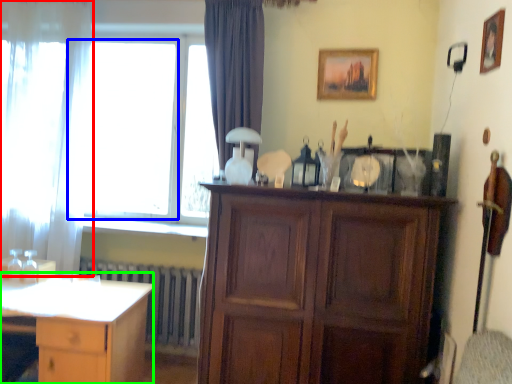
Question: Which object is positioned closest to curtain (highlighted by a red box)? Select from window (highlighted by a blue box) and desk (highlighted by a green box).

Choices:
 (A) window
 (B) desk

Answer: (A)